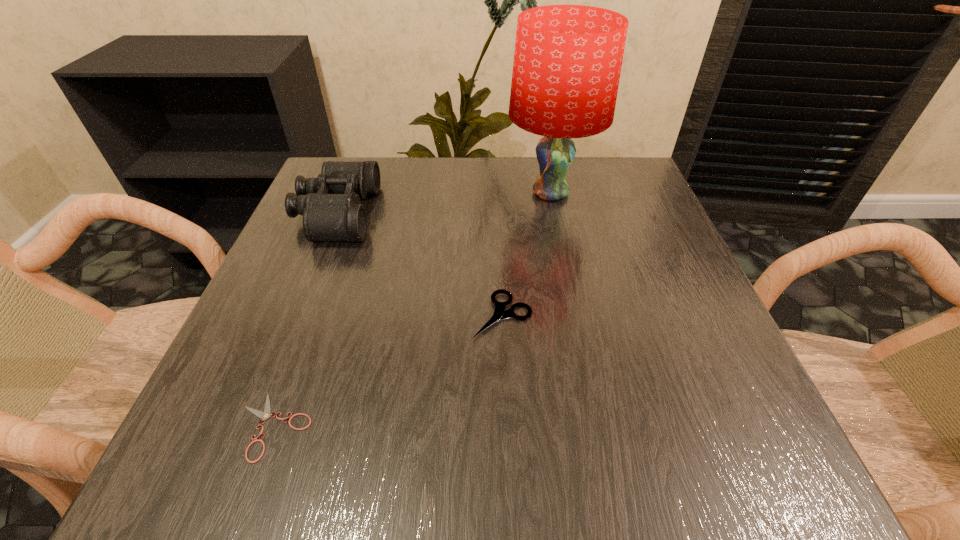
This screenshot has height=540, width=960. What are the coordinates of `the tallest object` in the screenshot? It's located at (567, 63).

In order to click on binoculars in this screenshot , I will do `click(330, 204)`.

In order to click on the third tallest object in this screenshot , I will do `click(500, 313)`.

Locate an element on the screen. the taller shears is located at coordinates (500, 313).

You are a GUI agent. You are given a task and a screenshot of the screen. Output one action in this format:
    pyautogui.click(x=<x>, y=<y>)
    Task: Click on the nearer shears
    The width and height of the screenshot is (960, 540).
    Given the screenshot: What is the action you would take?
    pyautogui.click(x=265, y=415)

The width and height of the screenshot is (960, 540). I want to click on the nearest object, so click(x=265, y=415).

Locate an element on the screen. free space located on the front-facing side of the tallest object is located at coordinates (570, 291).

This screenshot has width=960, height=540. I want to click on vacant space located at the eyepieces of the second tallest object, so click(396, 213).

Where is `vacant space situated 0.340m on the left of the third farthest object`? vacant space situated 0.340m on the left of the third farthest object is located at coordinates (273, 315).

What are the coordinates of `vacant position located on the back of the nearest object` in the screenshot? It's located at (317, 306).